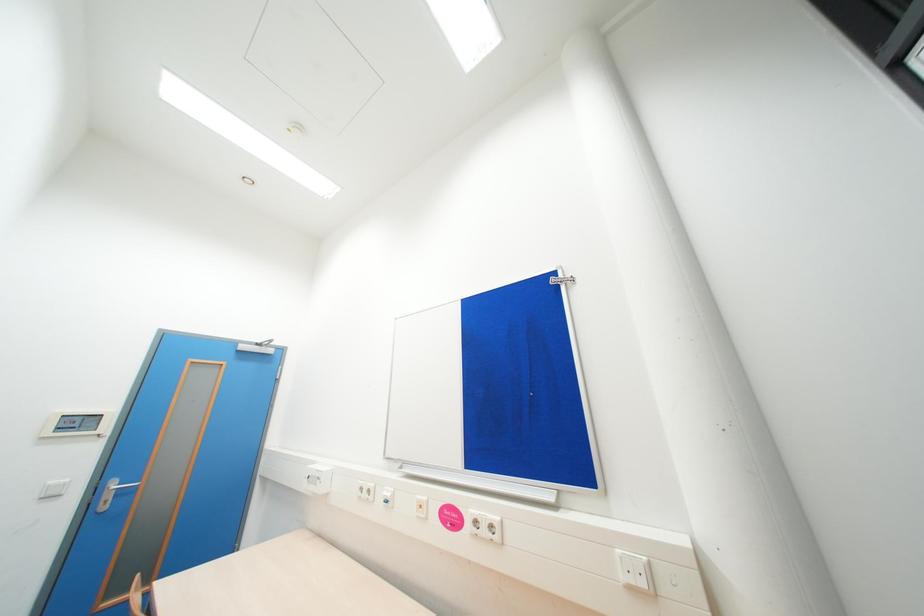
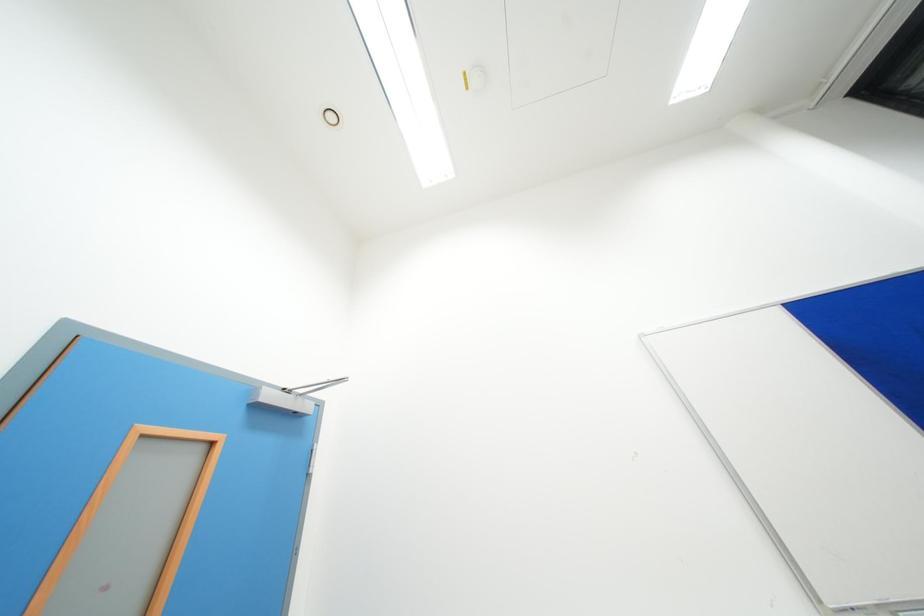
The images are taken continuously from a first-person perspective. In which direction are you moving?

The cameraman moved toward left, forward.